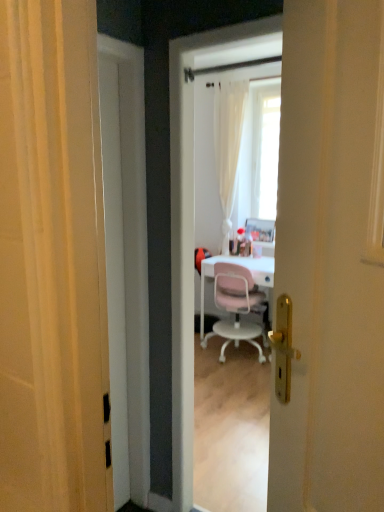
Locate an element on the screen. The width and height of the screenshot is (384, 512). vacant area on top of white glossy screen door at center (from a real-world perspective) is located at coordinates (232, 21).